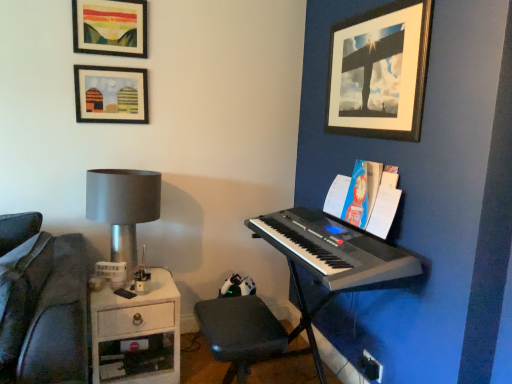
Question: Is matte glass picture frame at upper left, acting as the second picture frame starting from the left, not inside black plastic keyboard at right?

Choices:
 (A) yes
 (B) no

Answer: (A)

Question: Is matte glass picture frame at upper left, acting as the second picture frame starting from the left, positioned in front of black plastic keyboard at right?

Choices:
 (A) no
 (B) yes

Answer: (A)

Question: Can you confirm if matte glass picture frame at upper left, acting as the second picture frame starting from the left, is taller than black plastic keyboard at right?

Choices:
 (A) yes
 (B) no

Answer: (A)

Question: Considering the relative positions of matte glass picture frame at upper left, acting as the second picture frame starting from the left, and black plastic keyboard at right in the image provided, is matte glass picture frame at upper left, acting as the second picture frame starting from the left, to the right of black plastic keyboard at right from the viewer's perspective?

Choices:
 (A) no
 (B) yes

Answer: (A)

Question: Does matte glass picture frame at upper left, placed as the second picture frame when sorted from right to left, have a lesser width compared to black plastic keyboard at right?

Choices:
 (A) yes
 (B) no

Answer: (A)

Question: From the image's perspective, would you say matte glass picture frame at upper left, acting as the second picture frame starting from the left, is positioned over black plastic keyboard at right?

Choices:
 (A) no
 (B) yes

Answer: (B)

Question: Does black plastic keyboard at right have a greater width compared to matte glass picture frame at upper left, acting as the second picture frame starting from the left?

Choices:
 (A) yes
 (B) no

Answer: (A)

Question: Does black plastic keyboard at right lie in front of matte glass picture frame at upper left, acting as the second picture frame starting from the left?

Choices:
 (A) yes
 (B) no

Answer: (A)

Question: Is black plastic keyboard at right oriented away from matte glass picture frame at upper left, placed as the second picture frame when sorted from right to left?

Choices:
 (A) no
 (B) yes

Answer: (A)

Question: From a real-world perspective, is black plastic keyboard at right positioned over matte glass picture frame at upper left, placed as the second picture frame when sorted from right to left, based on gravity?

Choices:
 (A) no
 (B) yes

Answer: (A)

Question: Is black plastic keyboard at right aimed at matte glass picture frame at upper left, acting as the second picture frame starting from the left?

Choices:
 (A) yes
 (B) no

Answer: (B)

Question: Is matte glass picture frame at upper left, placed as the second picture frame when sorted from right to left, surrounded by black plastic keyboard at right?

Choices:
 (A) no
 (B) yes

Answer: (A)

Question: Considering the relative positions of matte silver lamp at left and silver metallic keyboard at right in the image provided, is matte silver lamp at left to the right of silver metallic keyboard at right from the viewer's perspective?

Choices:
 (A) yes
 (B) no

Answer: (B)